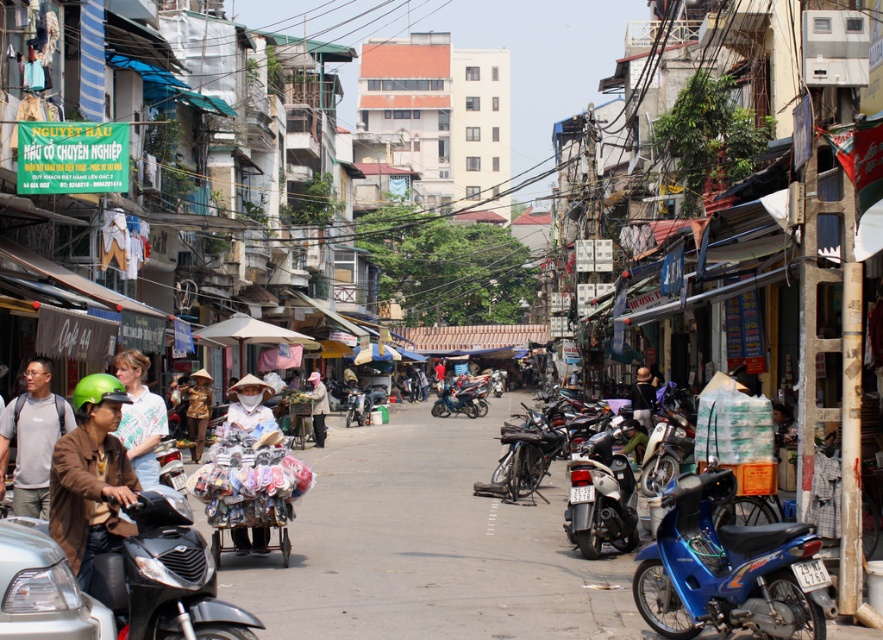
Measure the distance between blue metallic motorcycle at lower right and camera.

They are 8.88 meters apart.

Is point (791, 582) positioned behind point (122, 452)?

Yes, it is behind point (122, 452).

Identify the location of blue metallic motorcycle at lower right. The height and width of the screenshot is (640, 883). (728, 570).

Describe the element at coordinates (601, 499) in the screenshot. I see `shiny chrome motorcycle at center` at that location.

Consider the image. Can you confirm if shiny chrome motorcycle at center is taller than light brown fabric cart at center?

In fact, shiny chrome motorcycle at center may be shorter than light brown fabric cart at center.

Describe the element at coordinates (601, 499) in the screenshot. Image resolution: width=883 pixels, height=640 pixels. I see `shiny chrome motorcycle at center` at that location.

Image resolution: width=883 pixels, height=640 pixels. Identify the location of shiny chrome motorcycle at center. (601, 499).

Is blue metallic motorcycle at lower right shorter than light brown fabric cart at center?

Yes.

Does blue metallic motorcycle at lower right have a greater height compared to light brown fabric cart at center?

No, blue metallic motorcycle at lower right is not taller than light brown fabric cart at center.

Which is behind, point (763, 608) or point (318, 381)?

The point (318, 381) is more distant.

The height and width of the screenshot is (640, 883). What are the coordinates of `blue metallic motorcycle at lower right` in the screenshot? It's located at (728, 570).